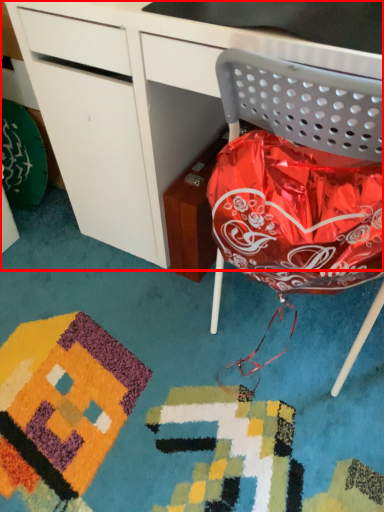
Question: From the image's perspective, considering the relative positions of desk (annotated by the red box) and chair in the image provided, where is desk (annotated by the red box) located with respect to the staircase?

Choices:
 (A) above
 (B) below

Answer: (A)